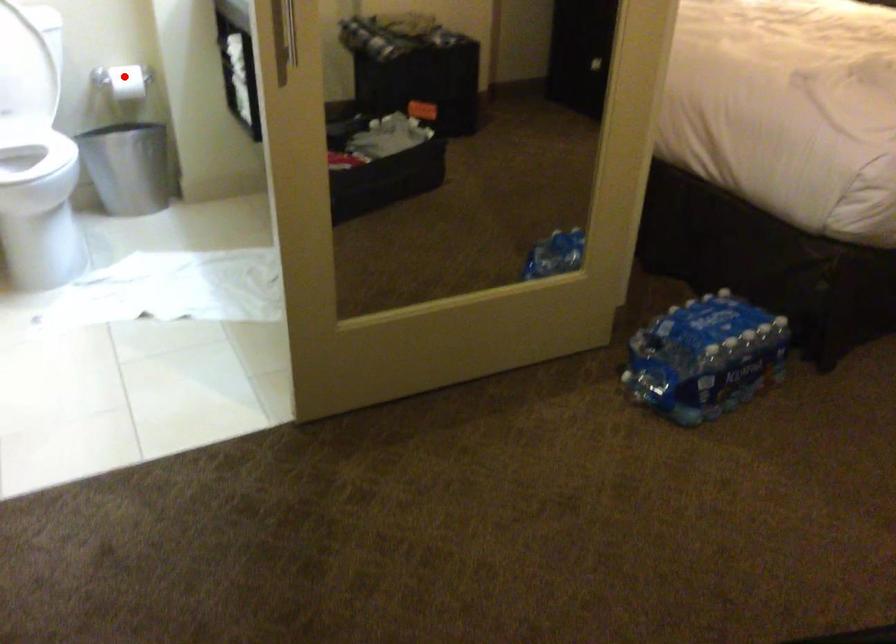
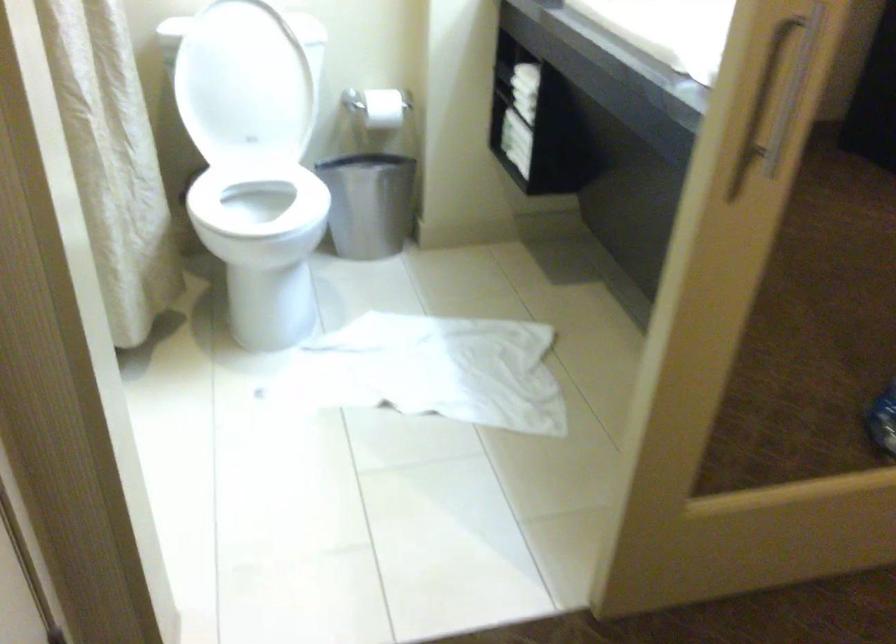
The point at the highlighted location is marked in the first image. Where is the corresponding point in the second image?

(383, 108)